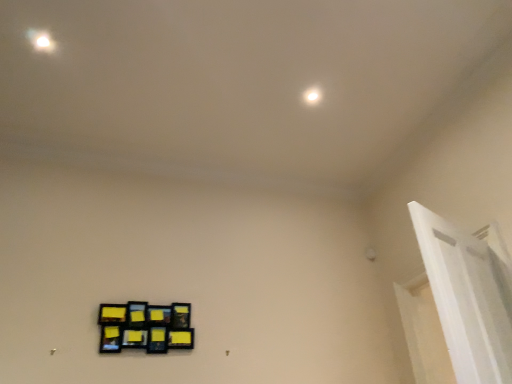
Question: From a real-world perspective, is white glossy light at upper center over white glossy door frame at upper right?

Choices:
 (A) yes
 (B) no

Answer: (A)

Question: Considering the relative positions of white glossy light at upper center and white glossy door frame at upper right in the image provided, is white glossy light at upper center behind white glossy door frame at upper right?

Choices:
 (A) yes
 (B) no

Answer: (A)

Question: Is white glossy light at upper center thinner than white glossy door frame at upper right?

Choices:
 (A) no
 (B) yes

Answer: (B)

Question: From a real-world perspective, is white glossy light at upper center physically below white glossy door frame at upper right?

Choices:
 (A) no
 (B) yes

Answer: (A)

Question: Does white glossy light at upper center contain white glossy door frame at upper right?

Choices:
 (A) yes
 (B) no

Answer: (B)

Question: Is white glossy light at upper center shorter than white glossy door frame at upper right?

Choices:
 (A) no
 (B) yes

Answer: (B)

Question: Can you confirm if white glossy door frame at upper right is smaller than white glossy light at upper center?

Choices:
 (A) no
 (B) yes

Answer: (A)

Question: Is white glossy door frame at upper right facing away from white glossy light at upper center?

Choices:
 (A) no
 (B) yes

Answer: (A)

Question: Considering the relative sizes of white glossy door frame at upper right and white glossy light at upper center in the image provided, is white glossy door frame at upper right shorter than white glossy light at upper center?

Choices:
 (A) yes
 (B) no

Answer: (B)

Question: From the image's perspective, is white glossy door frame at upper right on top of white glossy light at upper center?

Choices:
 (A) no
 (B) yes

Answer: (A)

Question: Considering the relative sizes of white glossy door frame at upper right and white glossy light at upper center in the image provided, is white glossy door frame at upper right thinner than white glossy light at upper center?

Choices:
 (A) no
 (B) yes

Answer: (A)

Question: From a real-world perspective, is white glossy door frame at upper right below white glossy light at upper center?

Choices:
 (A) yes
 (B) no

Answer: (A)

Question: From a real-world perspective, is black matte picture frame at lower left positioned over white glossy door frame at upper right based on gravity?

Choices:
 (A) no
 (B) yes

Answer: (B)